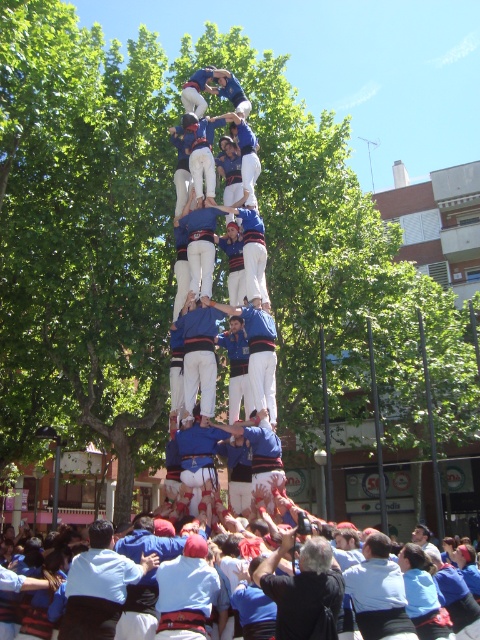
You are a photographer standing at the center of the park. You want to take a photo of the blue fabric shirt at center. Which direction should you point your camera to capture it?

The blue fabric shirt at center is located at point 0.927 on the x axis and 0.388 on the y axis. Since you are at the center of the park, you should point your camera to the right and slightly downward to capture the blue fabric shirt at center.

You are a photographer at the event and want to capture a photo of the human tower. You notice two participants wearing blue shirts at the center of the tower. Which participant wearing the blue fabric shirt at center is positioned lower in the tower compared to the blue cotton shirt at center?

The blue fabric shirt at center is shorter than the blue cotton shirt at center, so the participant wearing the blue fabric shirt at center is positioned lower in the tower.